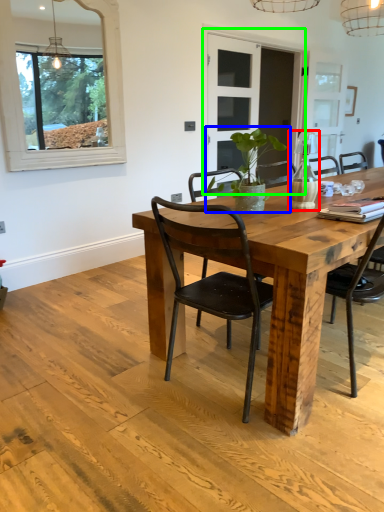
Question: Which object is the closest to the vase (highlighted by a red box)? Choose among these: houseplant (highlighted by a blue box) or glass door (highlighted by a green box).

Choices:
 (A) houseplant
 (B) glass door

Answer: (A)